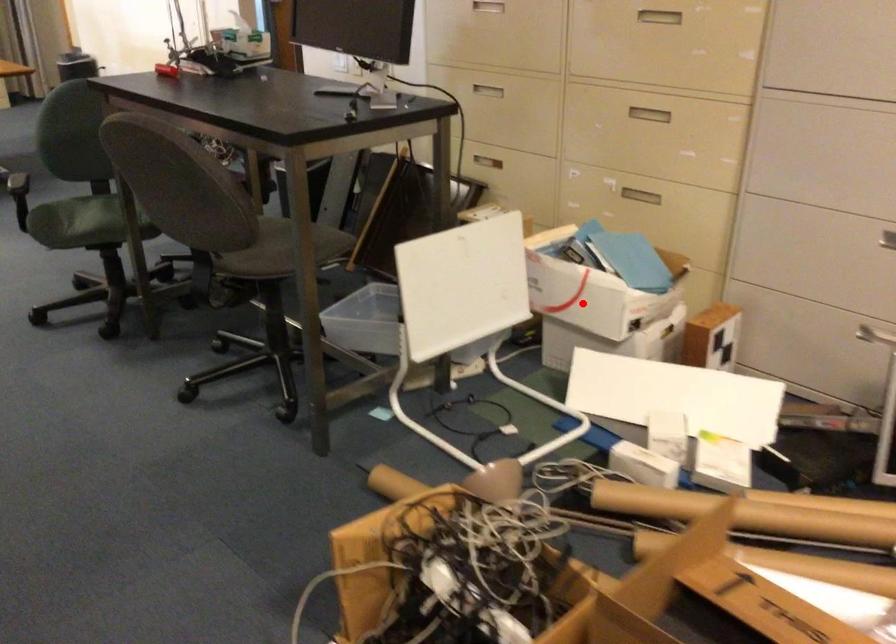
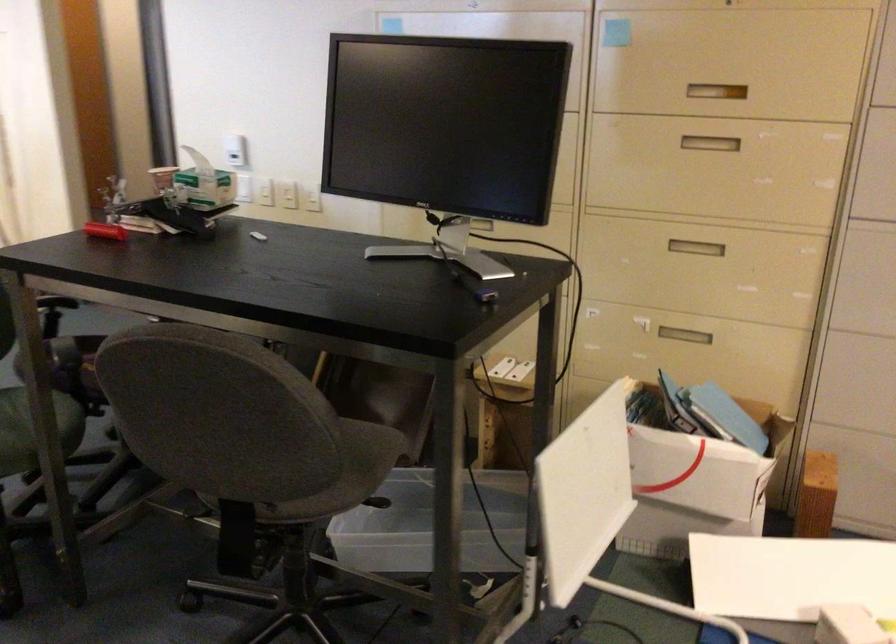
Question: I am providing you with two images of the same scene from different viewpoints. In image1, a red point is highlighted. Considering the same 3D point in image2, which of the following is correct?

Choices:
 (A) It is closer
 (B) It is farther

Answer: (A)